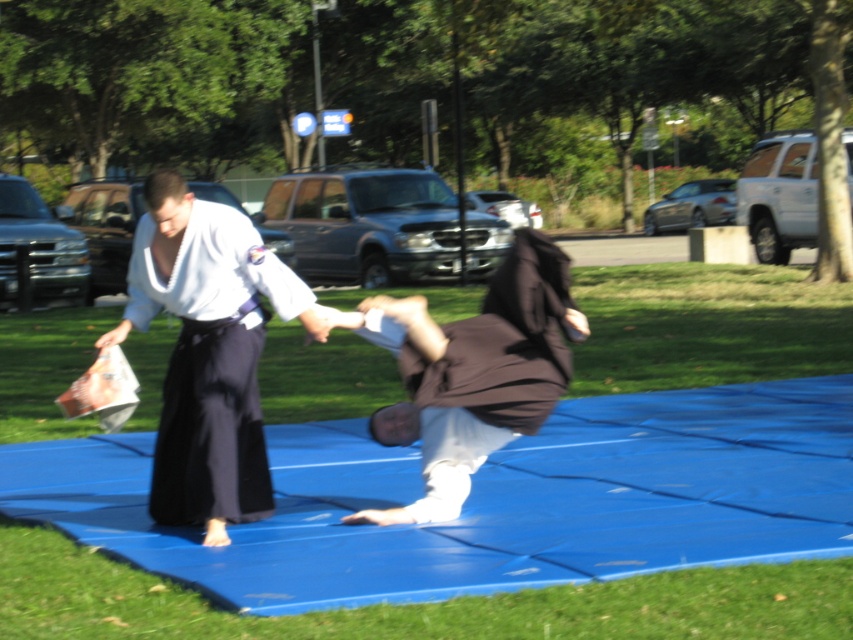
Between dark blue cotton kimono at center and brown fabric monk at center, which one has more height?

dark blue cotton kimono at center is taller.

Can you confirm if dark blue cotton kimono at center is positioned to the right of brown fabric monk at center?

No, dark blue cotton kimono at center is not to the right of brown fabric monk at center.

Does point (163, 465) come farther from viewer compared to point (558, 349)?

Yes.

Image resolution: width=853 pixels, height=640 pixels. I want to click on dark blue cotton kimono at center, so click(212, 362).